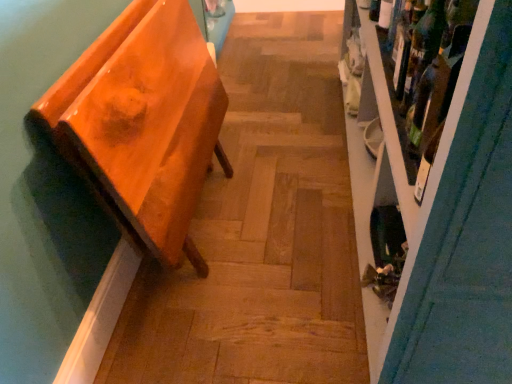
Question: Choose the correct answer: Is glossy orange bench at left inside translucent glass bottle at upper right or outside it?

Choices:
 (A) inside
 (B) outside

Answer: (B)

Question: Is glossy orange bench at left taller or shorter than translucent glass bottle at upper right?

Choices:
 (A) short
 (B) tall

Answer: (B)

Question: Considering the real-world distances, which object is farthest from the wooden shelf at right?

Choices:
 (A) translucent glass bottle at upper right
 (B) green glass wine bottle at upper right
 (C) glossy orange bench at left

Answer: (C)

Question: Which of these objects is positioned closest to the glossy orange bench at left?

Choices:
 (A) translucent glass bottle at upper right
 (B) green glass wine bottle at upper right
 (C) wooden shelf at right

Answer: (C)